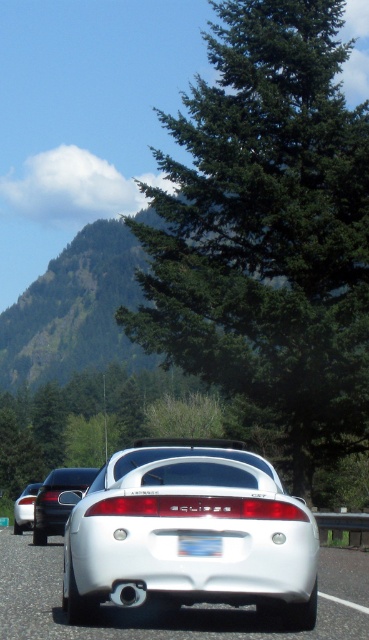
Is white glossy car at center thinner than white plastic license plate at center?

Incorrect, white glossy car at center's width is not less than white plastic license plate at center's.

Consider the image. Is white glossy car at center shorter than white plastic license plate at center?

No.

Which is behind, point (238, 627) or point (191, 556)?

The point (238, 627) is more distant.

This screenshot has height=640, width=369. Find the location of `white glossy car at center`. white glossy car at center is located at coordinates (181, 605).

Is white glossy sports car at center taller than white plastic license plate at center?

Incorrect, white glossy sports car at center's height is not larger of white plastic license plate at center's.

Who is taller, white glossy sports car at center or white plastic license plate at center?

white plastic license plate at center

Based on the photo, who is more forward, (295, 506) or (192, 548)?

Point (192, 548) is more forward.

Image resolution: width=369 pixels, height=640 pixels. Identify the location of white glossy sports car at center. [190, 532].

Is white glossy sports car at center thinner than white glossy car at center?

Indeed, white glossy sports car at center has a lesser width compared to white glossy car at center.

Describe the element at coordinates (190, 532) in the screenshot. I see `white glossy sports car at center` at that location.

Where is `white glossy sports car at center`? The width and height of the screenshot is (369, 640). white glossy sports car at center is located at coordinates (190, 532).